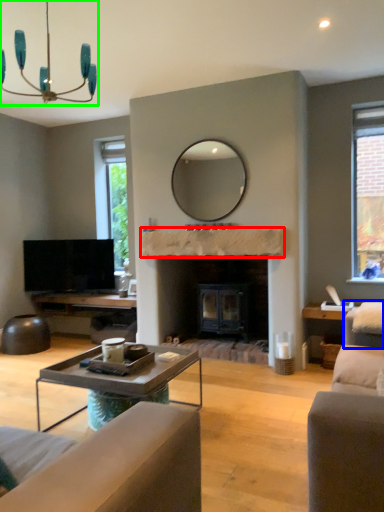
Question: Which object is positioned farthest from mantle (highlighted by a red box)? Select from swivel chair (highlighted by a blue box) and light fixture (highlighted by a green box).

Choices:
 (A) swivel chair
 (B) light fixture

Answer: (B)